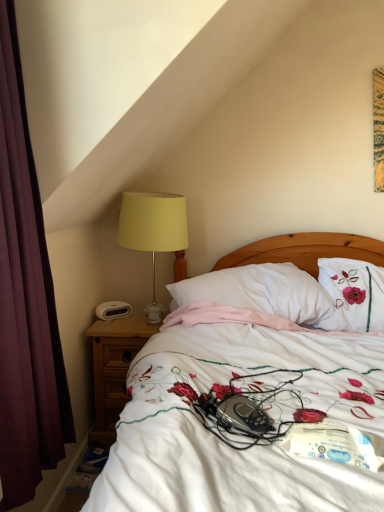
Question: In terms of height, does maroon fabric curtain at left look taller or shorter compared to white plastic alarm clock at left?

Choices:
 (A) tall
 (B) short

Answer: (A)

Question: Is maroon fabric curtain at left to the left or to the right of white plastic alarm clock at left in the image?

Choices:
 (A) left
 (B) right

Answer: (A)

Question: Based on their relative distances, which object is farther from the brown wooden nightstand at lower left?

Choices:
 (A) yellow fabric lampshade at left
 (B) maroon fabric curtain at left
 (C) white soft pillow at center
 (D) white floral bedspread at center
 (E) white plastic alarm clock at left

Answer: (B)

Question: Estimate the real-world distances between objects in this image. Which object is closer to the brown wooden nightstand at lower left?

Choices:
 (A) white plastic alarm clock at left
 (B) maroon fabric curtain at left
 (C) white soft pillow at center
 (D) white floral bedspread at center
 (E) yellow fabric lampshade at left

Answer: (A)